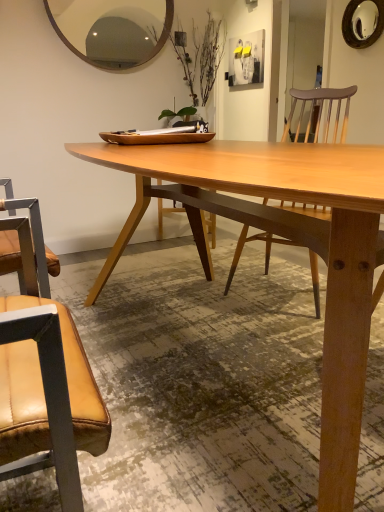
The image size is (384, 512). In order to click on wooden mirror at upper center, the first mirror in the bottom-to-top sequence in this screenshot , I will do `click(111, 29)`.

Image resolution: width=384 pixels, height=512 pixels. Describe the element at coordinates (111, 29) in the screenshot. I see `wooden mirror at upper center, the first mirror in the bottom-to-top sequence` at that location.

At what (x,y) coordinates should I click in order to perform the action: click on wooden mirror at upper right, which ranks as the 1th mirror in back-to-front order. Please return your answer as a coordinate pair (x, y). The width and height of the screenshot is (384, 512). Looking at the image, I should click on (363, 22).

You are a GUI agent. You are given a task and a screenshot of the screen. Output one action in this format:
    pyautogui.click(x=<x>, y=<y>)
    Task: Click on the wooden mirror at upper center, arranged as the second mirror when viewed from the back
    The width and height of the screenshot is (384, 512).
    Given the screenshot: What is the action you would take?
    pyautogui.click(x=111, y=29)

Considering the relative sizes of wooden mirror at upper right, which appears as the 1th mirror when viewed from the right, and natural wood table at center in the image provided, is wooden mirror at upper right, which appears as the 1th mirror when viewed from the right, wider than natural wood table at center?

No, wooden mirror at upper right, which appears as the 1th mirror when viewed from the right, is not wider than natural wood table at center.

Find the location of a particular element. Image resolution: width=384 pixels, height=512 pixels. coffee table lying on the left of wooden mirror at upper right, which appears as the 1th mirror when viewed from the right is located at coordinates (327, 248).

Based on the photo, relative to natural wood table at center, is wooden mirror at upper right, which ranks as the 1th mirror in back-to-front order, in front or behind?

Visually, wooden mirror at upper right, which ranks as the 1th mirror in back-to-front order, is located behind natural wood table at center.

Can we say wooden mirror at upper right, positioned as the 2th mirror in bottom-to-top order, lies outside natural wood table at center?

wooden mirror at upper right, positioned as the 2th mirror in bottom-to-top order, is positioned outside natural wood table at center.

Choose the correct answer: Is matte white picture frame at upper center inside wooden mirror at upper center, the second mirror in the right-to-left sequence, or outside it?

matte white picture frame at upper center is spatially situated outside wooden mirror at upper center, the second mirror in the right-to-left sequence.

Is there a large distance between matte white picture frame at upper center and wooden mirror at upper center, which is the 2th mirror in top-to-bottom order?

Yes, matte white picture frame at upper center and wooden mirror at upper center, which is the 2th mirror in top-to-bottom order, are quite far apart.

From a real-world perspective, which is physically above, matte white picture frame at upper center or wooden mirror at upper center, which is the first mirror from left to right?

From a 3D spatial view, matte white picture frame at upper center is above.

Is point (250, 61) positioned after point (72, 16)?

Yes, point (250, 61) is behind point (72, 16).

Considering the sizes of leather at left and wooden mirror at upper center, which is the first mirror from left to right, in the image, is leather at left bigger or smaller than wooden mirror at upper center, which is the first mirror from left to right,?

Clearly, leather at left is larger in size than wooden mirror at upper center, which is the first mirror from left to right.

Which of these two, leather at left or wooden mirror at upper center, which is the first mirror from left to right, stands shorter?

Standing shorter between the two is wooden mirror at upper center, which is the first mirror from left to right.

How many degrees apart are the facing directions of leather at left and wooden mirror at upper center, which is the first mirror in front-to-back order?

The angle between the facing direction of leather at left and the facing direction of wooden mirror at upper center, which is the first mirror in front-to-back order, is 86.4 degrees.

Can you confirm if leather at left is positioned to the left of wooden mirror at upper center, which is the 2th mirror in top-to-bottom order?

In fact, leather at left is to the right of wooden mirror at upper center, which is the 2th mirror in top-to-bottom order.

Where is `mirror on the left of wooden mirror at upper right, positioned as the 2th mirror in bottom-to-top order`? mirror on the left of wooden mirror at upper right, positioned as the 2th mirror in bottom-to-top order is located at coordinates (111, 29).

How far apart are wooden mirror at upper center, which is the first mirror in front-to-back order, and wooden mirror at upper right, which appears as the 1th mirror when viewed from the right?

1.99 meters.

Is point (158, 1) positioned behind point (345, 24)?

No, (158, 1) is closer to viewer.

From a real-world perspective, between wooden mirror at upper center, the second mirror in the right-to-left sequence, and wooden mirror at upper right, positioned as the 2th mirror in bottom-to-top order, who is vertically higher?

From a 3D spatial view, wooden mirror at upper right, positioned as the 2th mirror in bottom-to-top order, is above.

From a real-world perspective, between matte white picture frame at upper center and leather at left, who is vertically higher?

From a 3D spatial view, matte white picture frame at upper center is above.

Based on the photo, how different are the orientations of matte white picture frame at upper center and leather at left in degrees?

The facing directions of matte white picture frame at upper center and leather at left are 176 degrees apart.

Between matte white picture frame at upper center and leather at left, which one is positioned behind?

matte white picture frame at upper center is further from the camera.

Is point (237, 62) positioned before point (28, 376)?

No.

From the picture: Considering the sizes of wooden mirror at upper right, positioned as the 2th mirror in bottom-to-top order, and leather at left in the image, is wooden mirror at upper right, positioned as the 2th mirror in bottom-to-top order, taller or shorter than leather at left?

wooden mirror at upper right, positioned as the 2th mirror in bottom-to-top order, is shorter than leather at left.

How far apart are wooden mirror at upper right, which ranks as the 1th mirror in back-to-front order, and leather at left?

They are 3.74 meters apart.

How many degrees apart are the facing directions of wooden mirror at upper right, which ranks as the 1th mirror in back-to-front order, and leather at left?

176 degrees separate the facing orientations of wooden mirror at upper right, which ranks as the 1th mirror in back-to-front order, and leather at left.

Is point (346, 17) farther from camera compared to point (52, 408)?

Yes, point (346, 17) is farther from viewer.

Image resolution: width=384 pixels, height=512 pixels. What are the coordinates of `picture frame above the wooden mirror at upper right, positioned as the 2th mirror in bottom-to-top order (from the image's perspective)` in the screenshot? It's located at (246, 59).

Is wooden mirror at upper right, which ranks as the 1th mirror in back-to-front order, smaller than matte white picture frame at upper center?

Yes.

How many degrees apart are the facing directions of wooden mirror at upper right, which ranks as the 1th mirror in back-to-front order, and matte white picture frame at upper center?

The angular difference between wooden mirror at upper right, which ranks as the 1th mirror in back-to-front order, and matte white picture frame at upper center is 0.00486 degrees.

Considering the sizes of wooden mirror at upper right, positioned as the 2th mirror in bottom-to-top order, and matte white picture frame at upper center in the image, is wooden mirror at upper right, positioned as the 2th mirror in bottom-to-top order, wider or thinner than matte white picture frame at upper center?

Considering their sizes, wooden mirror at upper right, positioned as the 2th mirror in bottom-to-top order, looks broader than matte white picture frame at upper center.

At what (x,y) coordinates should I click in order to perform the action: click on coffee table below the wooden mirror at upper right, which appears as the 1th mirror when viewed from the right (from the image's perspective). Please return your answer as a coordinate pair (x, y). The width and height of the screenshot is (384, 512). Looking at the image, I should click on (327, 248).

I want to click on picture frame that is above the wooden mirror at upper center, the second mirror in the right-to-left sequence (from a real-world perspective), so click(x=246, y=59).

Based on their spatial positions, is natural wood table at center or matte white picture frame at upper center closer to wooden mirror at upper center, which is the first mirror in front-to-back order?

natural wood table at center.

From the image, which object appears to be nearer to leather at left, wooden mirror at upper center, which is the first mirror from left to right, or wooden mirror at upper right, which appears as the 1th mirror when viewed from the right?

wooden mirror at upper center, which is the first mirror from left to right, lies closer to leather at left than the other object.

Estimate the real-world distances between objects in this image. Which object is closer to leather at left, wooden mirror at upper center, the second mirror in the right-to-left sequence, or natural wood table at center?

natural wood table at center lies closer to leather at left than the other object.

Based on their spatial positions, is natural wood table at center or leather at left closer to wooden mirror at upper right, which appears as the 1th mirror when viewed from the right?

The object closer to wooden mirror at upper right, which appears as the 1th mirror when viewed from the right, is natural wood table at center.

Considering their positions, is leather at left positioned closer to matte white picture frame at upper center than wooden mirror at upper center, the second mirror in the right-to-left sequence?

Among the two, wooden mirror at upper center, the second mirror in the right-to-left sequence, is located nearer to matte white picture frame at upper center.

When comparing their distances from natural wood table at center, does leather at left or matte white picture frame at upper center seem closer?

leather at left is positioned closer to the anchor natural wood table at center.

When comparing their distances from wooden mirror at upper right, which ranks as the 1th mirror in back-to-front order, does natural wood table at center or matte white picture frame at upper center seem further?

Among the two, natural wood table at center is located further to wooden mirror at upper right, which ranks as the 1th mirror in back-to-front order.

Looking at the image, which one is located further to natural wood table at center, wooden mirror at upper right, which ranks as the 1th mirror in back-to-front order, or matte white picture frame at upper center?

matte white picture frame at upper center lies further to natural wood table at center than the other object.

This screenshot has height=512, width=384. What are the coordinates of `coffee table between leather at left and wooden mirror at upper right, which ranks as the 1th mirror in back-to-front order, in the front-back direction` in the screenshot? It's located at (327, 248).

Identify the location of mirror located between leather at left and wooden mirror at upper right, the second mirror positioned from the left, in the depth direction. This screenshot has width=384, height=512. (111, 29).

Locate an element on the screen. mirror between natural wood table at center and wooden mirror at upper right, the 2th mirror viewed from the front, along the z-axis is located at coordinates (111, 29).

You are a GUI agent. You are given a task and a screenshot of the screen. Output one action in this format:
    pyautogui.click(x=<x>, y=<y>)
    Task: Click on the mirror positioned between wooden mirror at upper center, which is the first mirror from left to right, and matte white picture frame at upper center from near to far
    
    Given the screenshot: What is the action you would take?
    pyautogui.click(x=363, y=22)